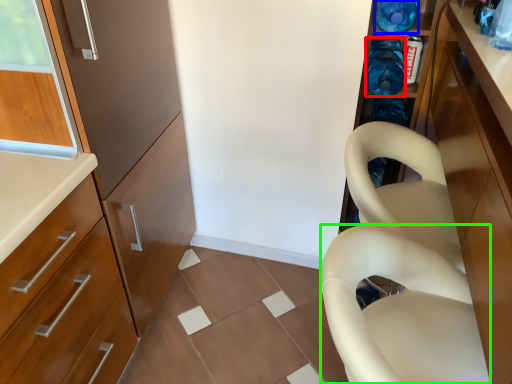
Question: Considering the real-world distances, which object is closest to bottle (highlighted by a red box)? bottle (highlighted by a blue box) or feeding chair (highlighted by a green box).

Choices:
 (A) bottle
 (B) feeding chair

Answer: (A)